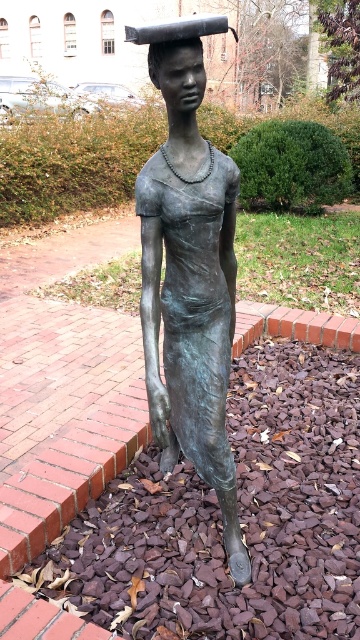
Question: Which point is closer to the camera?

Choices:
 (A) (185, 42)
 (B) (236, 534)

Answer: (A)

Question: Does bronze statue at center appear on the right side of bronze statue head at upper center?

Choices:
 (A) no
 (B) yes

Answer: (B)

Question: Can you confirm if bronze statue at center is bigger than bronze statue head at upper center?

Choices:
 (A) yes
 (B) no

Answer: (A)

Question: Which of the following is the closest to the observer?

Choices:
 (A) (171, 97)
 (B) (168, 88)

Answer: (B)

Question: Is bronze statue at center thinner than bronze statue head at upper center?

Choices:
 (A) no
 (B) yes

Answer: (A)